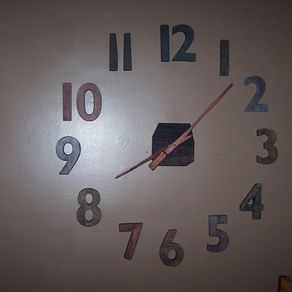
Where is `center point on clock`? Image resolution: width=292 pixels, height=292 pixels. center point on clock is located at coordinates (182, 152).